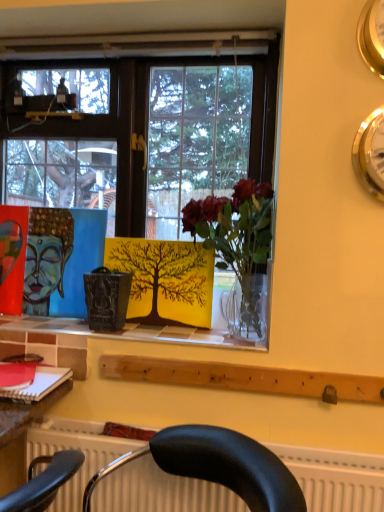
Question: Considering the relative sizes of matte red book at lower left and matte blue painting at center in the image provided, is matte red book at lower left wider than matte blue painting at center?

Choices:
 (A) yes
 (B) no

Answer: (A)

Question: Can you confirm if matte red book at lower left is bigger than matte blue painting at center?

Choices:
 (A) yes
 (B) no

Answer: (B)

Question: Can we say matte red book at lower left lies outside matte blue painting at center?

Choices:
 (A) no
 (B) yes

Answer: (B)

Question: Considering the relative sizes of matte red book at lower left and matte blue painting at center in the image provided, is matte red book at lower left smaller than matte blue painting at center?

Choices:
 (A) yes
 (B) no

Answer: (A)

Question: Is matte red book at lower left to the left of matte blue painting at center from the viewer's perspective?

Choices:
 (A) no
 (B) yes

Answer: (B)

Question: From the image's perspective, is matte red book at lower left over matte blue painting at center?

Choices:
 (A) no
 (B) yes

Answer: (A)

Question: Is gold metallic clock at upper right, which ranks as the first clock in top-to-bottom order, not close to gold metallic clock at upper right, marked as the 2th clock in a top-to-bottom arrangement?

Choices:
 (A) yes
 (B) no

Answer: (B)

Question: From a real-world perspective, is gold metallic clock at upper right, which ranks as the first clock in top-to-bottom order, on gold metallic clock at upper right, the 1th clock when ordered from bottom to top?

Choices:
 (A) yes
 (B) no

Answer: (A)

Question: From a real-world perspective, is gold metallic clock at upper right, which ranks as the first clock in top-to-bottom order, positioned under gold metallic clock at upper right, the 1th clock when ordered from bottom to top, based on gravity?

Choices:
 (A) no
 (B) yes

Answer: (A)

Question: Does gold metallic clock at upper right, which ranks as the first clock in top-to-bottom order, lie in front of gold metallic clock at upper right, marked as the 2th clock in a top-to-bottom arrangement?

Choices:
 (A) no
 (B) yes

Answer: (B)

Question: Can you confirm if gold metallic clock at upper right, which ranks as the first clock in top-to-bottom order, is thinner than gold metallic clock at upper right, marked as the 2th clock in a top-to-bottom arrangement?

Choices:
 (A) yes
 (B) no

Answer: (A)

Question: Does gold metallic clock at upper right, which appears as the second clock when ordered from the bottom, have a larger size compared to gold metallic clock at upper right, the 1th clock when ordered from bottom to top?

Choices:
 (A) no
 (B) yes

Answer: (A)

Question: Considering the relative sizes of gold metallic clock at upper right, the 1th clock when ordered from bottom to top, and matte red book at lower left in the image provided, is gold metallic clock at upper right, the 1th clock when ordered from bottom to top, taller than matte red book at lower left?

Choices:
 (A) yes
 (B) no

Answer: (A)